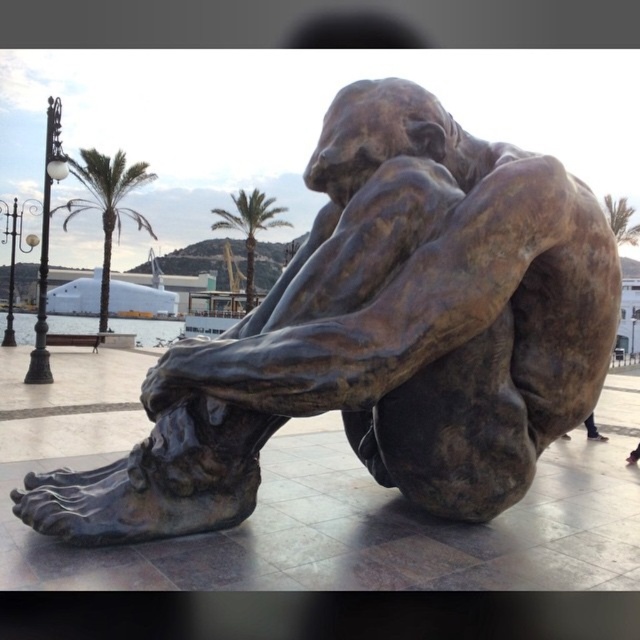
You are a photographer planning to capture a wide shot of the bronze statue at center and the green leafy palm tree at upper left. Based on their sizes, which object would likely occupy more space in your photo?

The bronze statue at center might occupy more space in the photo since it is wider than the green leafy palm tree at upper left according to the description.

You are standing in front of the bronze sculpture and want to take a photo that includes both the green leafy palm tree at upper left and the green leafy palm tree at center. Which palm tree is shorter and should be positioned lower in the frame to ensure both are fully visible?

The green leafy palm tree at upper left is shorter than the green leafy palm tree at center, so it should be positioned lower in the frame to ensure both are fully visible.

You are standing in front of the large bronze sculpture and want to take a photo that includes both the green leafy palm tree at upper left and the green leafy palm tree at center. Which palm tree should you move closer to in order to make them appear the same size in your photo?

To make both the green leafy palm tree at upper left and the green leafy palm tree at center appear the same size in the photo, you should move closer to the green leafy palm tree at upper left since it is smaller than the one at center.